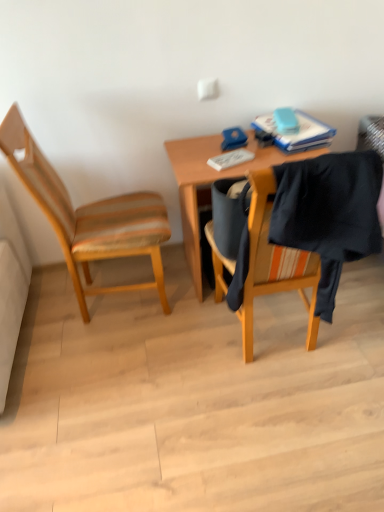
Question: Is wooden desk at center taller or shorter than blue matte book at upper right?

Choices:
 (A) tall
 (B) short

Answer: (A)

Question: From the image's perspective, relative to blue matte book at upper right, is wooden desk at center above or below?

Choices:
 (A) above
 (B) below

Answer: (B)

Question: Estimate the real-world distances between objects in this image. Which object is farther from the black fabric at right?

Choices:
 (A) blue matte book at upper right
 (B) wooden desk at center
 (C) wooden chair at left

Answer: (C)

Question: Which of these objects is positioned closest to the wooden chair at left?

Choices:
 (A) wooden desk at center
 (B) blue matte book at upper right
 (C) black fabric at right

Answer: (A)